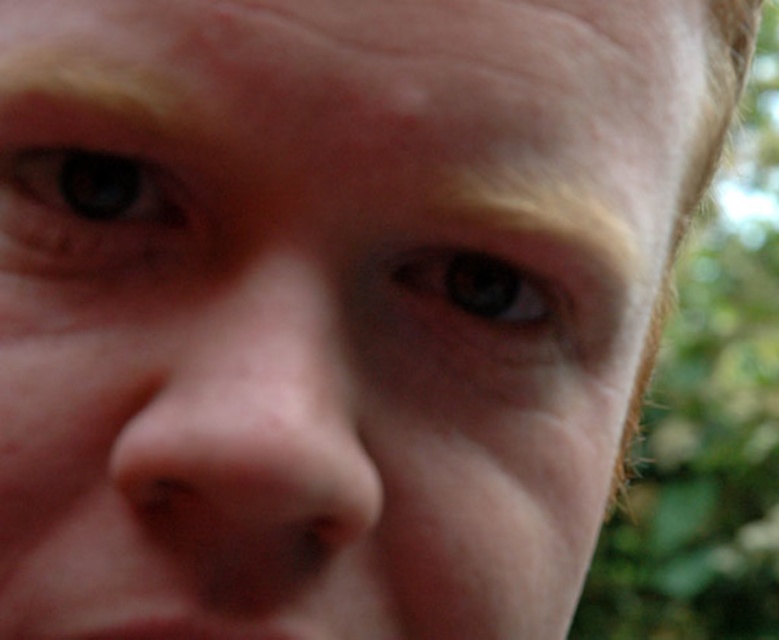
You are a photographer adjusting your camera to focus on the blue matte eye at upper left. What coordinate should you set to ensure the eye is in focus?

The blue matte eye at upper left is located at coordinate point (93, 202), so you should set the camera focus to that coordinate to ensure the eye is in focus.

You are a photographer adjusting the focus on your camera. You want to ensure both the smooth skin nose at center and the brown matte eye at center are in focus. Given their sizes, which object should you adjust the focus on first to ensure proper depth of field?

The smooth skin nose at center is larger than the brown matte eye at center. To ensure proper depth of field, focus on the larger object first, so you should adjust the focus on the smooth skin nose at center first.

Based on the photo, you are a photographer adjusting the focus on your camera. You have to decide which feature, the smooth skin nose at center or the brown matte eye at center, will be easier to capture in sharp detail due to their size. Which one would you choose?

The smooth skin nose at center has a greater width than the brown matte eye at center, so it will be easier to capture the smooth skin nose at center in sharp detail because larger features are generally easier to focus on.